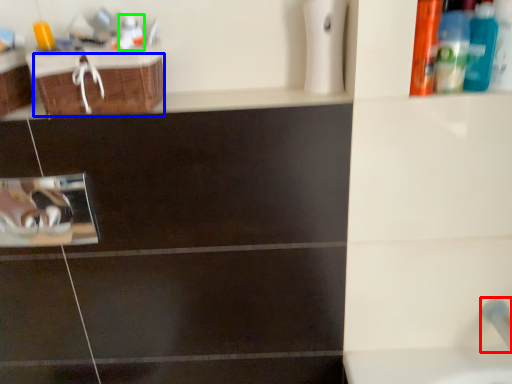
Question: Which is farther away from plumbing fixture (highlighted by a red box)? drawer (highlighted by a blue box) or mouthwash (highlighted by a green box)?

Choices:
 (A) drawer
 (B) mouthwash

Answer: (B)